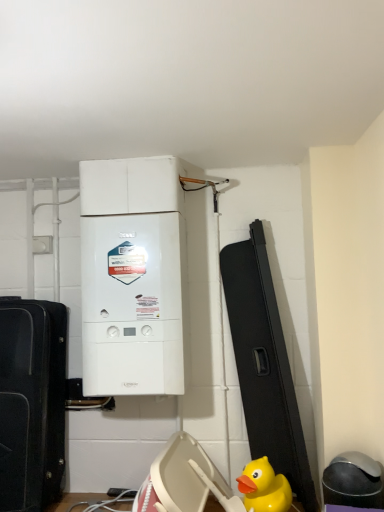
Question: From the image's perspective, is white matte boiler at center located above yellow rubber duck at lower right?

Choices:
 (A) yes
 (B) no

Answer: (A)

Question: Is white matte boiler at center bigger than yellow rubber duck at lower right?

Choices:
 (A) no
 (B) yes

Answer: (B)

Question: Considering the relative positions of white matte boiler at center and yellow rubber duck at lower right in the image provided, is white matte boiler at center to the right of yellow rubber duck at lower right from the viewer's perspective?

Choices:
 (A) yes
 (B) no

Answer: (B)

Question: Can you see white matte boiler at center touching yellow rubber duck at lower right?

Choices:
 (A) yes
 (B) no

Answer: (B)

Question: Is white matte boiler at center outside of yellow rubber duck at lower right?

Choices:
 (A) yes
 (B) no

Answer: (A)

Question: From a real-world perspective, relative to yellow rubber duck at lower right, is white matte boiler at center vertically above or below?

Choices:
 (A) above
 (B) below

Answer: (A)

Question: Is white matte boiler at center taller or shorter than yellow rubber duck at lower right?

Choices:
 (A) short
 (B) tall

Answer: (B)

Question: From the image's perspective, is white matte boiler at center above or below yellow rubber duck at lower right?

Choices:
 (A) above
 (B) below

Answer: (A)

Question: In the image, is white matte boiler at center on the left side or the right side of yellow rubber duck at lower right?

Choices:
 (A) right
 (B) left

Answer: (B)

Question: From the image's perspective, is yellow rubber duck at lower right positioned above or below black matte suitcase at left?

Choices:
 (A) below
 (B) above

Answer: (A)

Question: Based on their positions, is yellow rubber duck at lower right located to the left or right of black matte suitcase at left?

Choices:
 (A) right
 (B) left

Answer: (A)

Question: From a real-world perspective, is yellow rubber duck at lower right above or below black matte suitcase at left?

Choices:
 (A) above
 (B) below

Answer: (B)

Question: Is point (264, 473) positioned closer to the camera than point (4, 391)?

Choices:
 (A) farther
 (B) closer

Answer: (B)

Question: From a real-world perspective, is black matte suitcase at left positioned above or below white matte boiler at center?

Choices:
 (A) above
 (B) below

Answer: (B)

Question: Considering their positions, is black matte suitcase at left located in front of or behind white matte boiler at center?

Choices:
 (A) behind
 (B) front

Answer: (B)